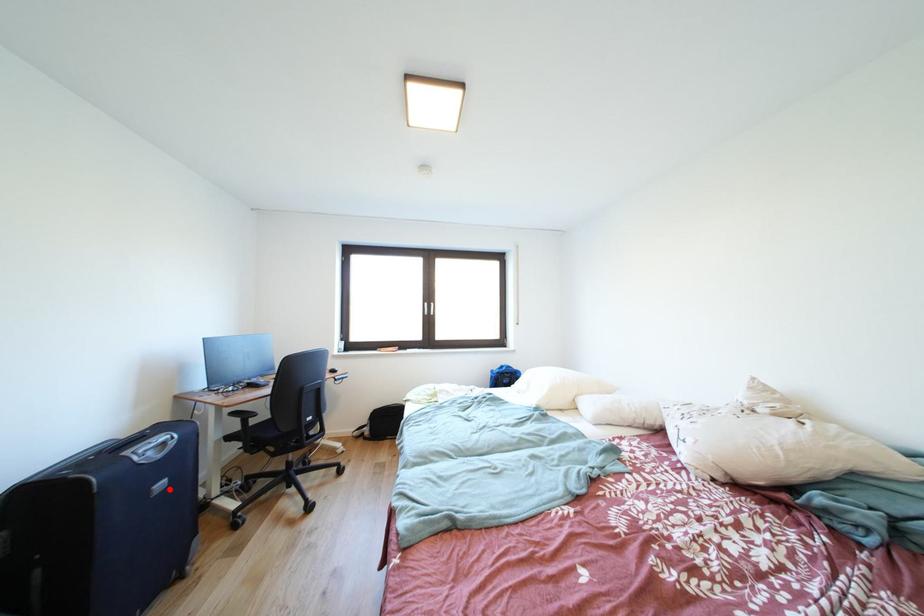
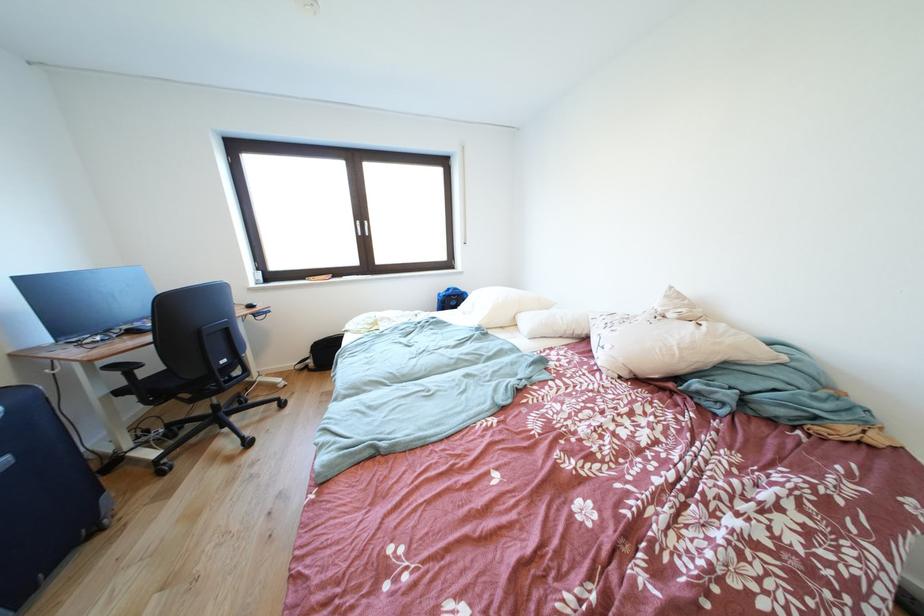
Question: A red point is marked in image1. In image2, is the corresponding 3D point closer to the camera or farther? Reply with the corresponding letter.

Choices:
 (A) The corresponding 3D point is closer.
 (B) The corresponding 3D point is farther.

Answer: (B)